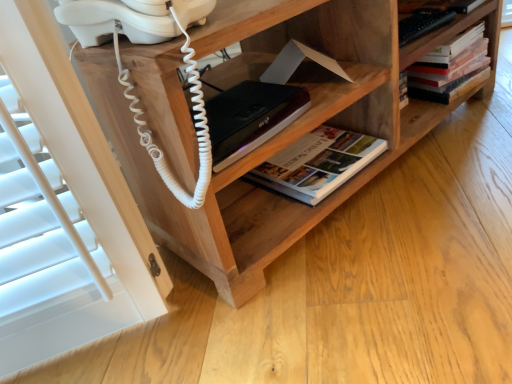
Question: Can you confirm if hardcover book at upper right, placed as the second book when sorted from bottom to top, is bigger than hardcover book at center, the first book in the bottom-to-top sequence?

Choices:
 (A) no
 (B) yes

Answer: (B)

Question: Can you confirm if hardcover book at upper right, the 2th book in the left-to-right sequence, is thinner than hardcover book at center, acting as the 2th book starting from the right?

Choices:
 (A) yes
 (B) no

Answer: (A)

Question: Can you confirm if hardcover book at upper right, which is counted as the first book, starting from the top, is taller than hardcover book at center, acting as the 2th book starting from the right?

Choices:
 (A) no
 (B) yes

Answer: (B)

Question: Does hardcover book at upper right, the first book from the right, appear on the left side of hardcover book at center, the first book in the bottom-to-top sequence?

Choices:
 (A) yes
 (B) no

Answer: (B)

Question: Is hardcover book at upper right, the 2th book in the left-to-right sequence, shorter than hardcover book at center, the first book in the bottom-to-top sequence?

Choices:
 (A) yes
 (B) no

Answer: (B)

Question: Does hardcover book at upper right, which is counted as the first book, starting from the top, lie behind hardcover book at center, acting as the 2th book starting from the right?

Choices:
 (A) yes
 (B) no

Answer: (A)

Question: From the image's perspective, is hardcover book at upper right, the first book from the right, beneath black matte book at center?

Choices:
 (A) yes
 (B) no

Answer: (B)

Question: Is hardcover book at upper right, placed as the second book when sorted from bottom to top, smaller than black matte book at center?

Choices:
 (A) no
 (B) yes

Answer: (A)

Question: Can we say hardcover book at upper right, which is counted as the first book, starting from the top, lies outside black matte book at center?

Choices:
 (A) no
 (B) yes

Answer: (B)

Question: Considering the relative positions of hardcover book at upper right, placed as the second book when sorted from bottom to top, and black matte book at center in the image provided, is hardcover book at upper right, placed as the second book when sorted from bottom to top, in front of black matte book at center?

Choices:
 (A) yes
 (B) no

Answer: (B)

Question: Does hardcover book at upper right, the first book from the right, have a larger size compared to black matte book at center?

Choices:
 (A) yes
 (B) no

Answer: (A)

Question: Considering the relative sizes of hardcover book at upper right, the first book from the right, and black matte book at center in the image provided, is hardcover book at upper right, the first book from the right, shorter than black matte book at center?

Choices:
 (A) no
 (B) yes

Answer: (A)

Question: Is wooden shelf at center positioned behind hardcover book at center, acting as the 2th book starting from the right?

Choices:
 (A) no
 (B) yes

Answer: (A)